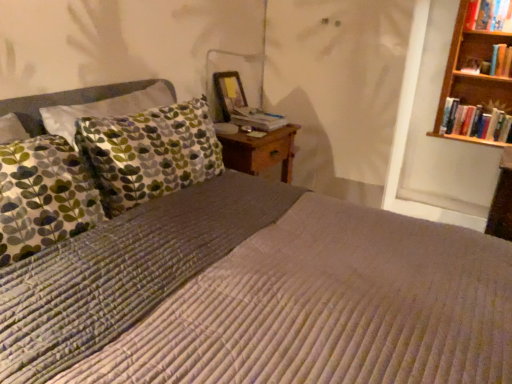
Question: Would you say hardcover book at center is to the left or to the right of hardcover book at upper right, which ranks as the 2th book in top-to-bottom order, in the picture?

Choices:
 (A) right
 (B) left

Answer: (B)

Question: Is hardcover book at center inside the boundaries of hardcover book at upper right, acting as the second book starting from the bottom, or outside?

Choices:
 (A) inside
 (B) outside

Answer: (B)

Question: Which is farther from the hardcover book at upper right, acting as the second book starting from the bottom?

Choices:
 (A) hardcover book at upper right, which is the first book in top-to-bottom order
 (B) hardcover book at center
 (C) hardcover books at right, the 1th book ordered from the bottom
 (D) matte wooden picture frame at upper center

Answer: (D)

Question: Which object is the closest to the matte wooden picture frame at upper center?

Choices:
 (A) hardcover book at upper right, which is the first book in top-to-bottom order
 (B) hardcover book at upper right, acting as the second book starting from the bottom
 (C) hardcover books at right, the third book from the top
 (D) hardcover book at center

Answer: (D)